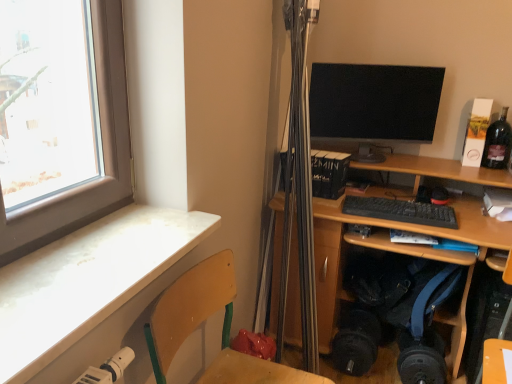
Question: Is black matte keyboard at center surrounding wooden at left?

Choices:
 (A) yes
 (B) no

Answer: (B)

Question: Considering the relative sizes of black matte keyboard at center and wooden at left in the image provided, is black matte keyboard at center thinner than wooden at left?

Choices:
 (A) yes
 (B) no

Answer: (A)

Question: Is black matte keyboard at center with wooden at left?

Choices:
 (A) no
 (B) yes

Answer: (A)

Question: Does black matte keyboard at center appear on the left side of wooden at left?

Choices:
 (A) yes
 (B) no

Answer: (B)

Question: Does black matte keyboard at center have a smaller size compared to wooden at left?

Choices:
 (A) no
 (B) yes

Answer: (B)

Question: Considering the relative sizes of black matte keyboard at center and wooden at left in the image provided, is black matte keyboard at center shorter than wooden at left?

Choices:
 (A) no
 (B) yes

Answer: (B)

Question: Does matte black monitor at upper right have a lesser height compared to white marble desk at lower left, the first desk positioned from the front?

Choices:
 (A) no
 (B) yes

Answer: (A)

Question: Considering the relative sizes of matte black monitor at upper right and white marble desk at lower left, the first desk positioned from the front, in the image provided, is matte black monitor at upper right wider than white marble desk at lower left, the first desk positioned from the front,?

Choices:
 (A) no
 (B) yes

Answer: (A)

Question: Does matte black monitor at upper right appear on the left side of white marble desk at lower left, the first desk positioned from the front?

Choices:
 (A) yes
 (B) no

Answer: (B)

Question: Does matte black monitor at upper right have a smaller size compared to white marble desk at lower left, arranged as the 2th desk when viewed from the right?

Choices:
 (A) yes
 (B) no

Answer: (B)

Question: From a real-world perspective, is matte black monitor at upper right physically below white marble desk at lower left, arranged as the 2th desk when viewed from the right?

Choices:
 (A) no
 (B) yes

Answer: (A)

Question: From a real-world perspective, is matte black monitor at upper right located higher than white marble desk at lower left, the first desk positioned from the front?

Choices:
 (A) no
 (B) yes

Answer: (B)

Question: From a real-world perspective, is matte black monitor at upper right beneath dark glass bottle at upper right?

Choices:
 (A) no
 (B) yes

Answer: (A)